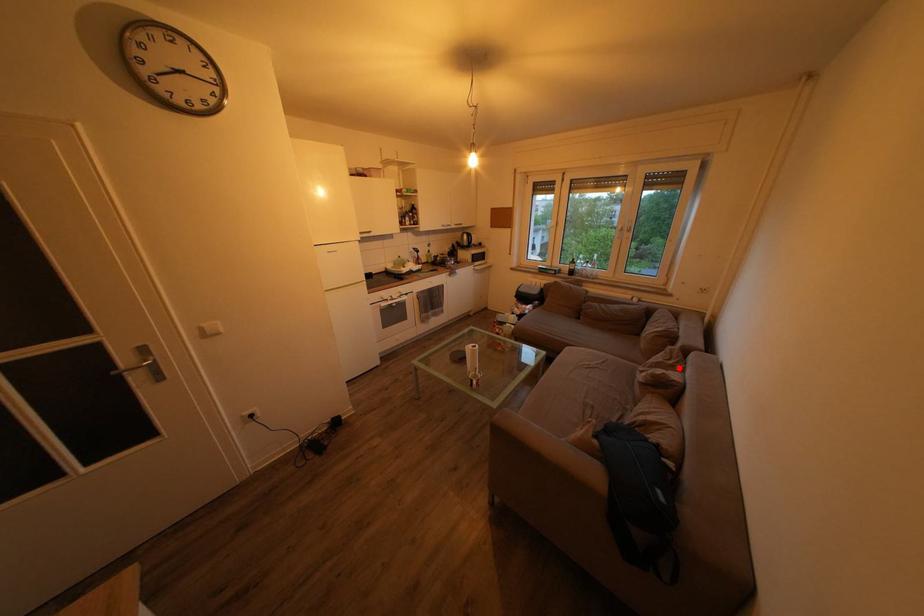
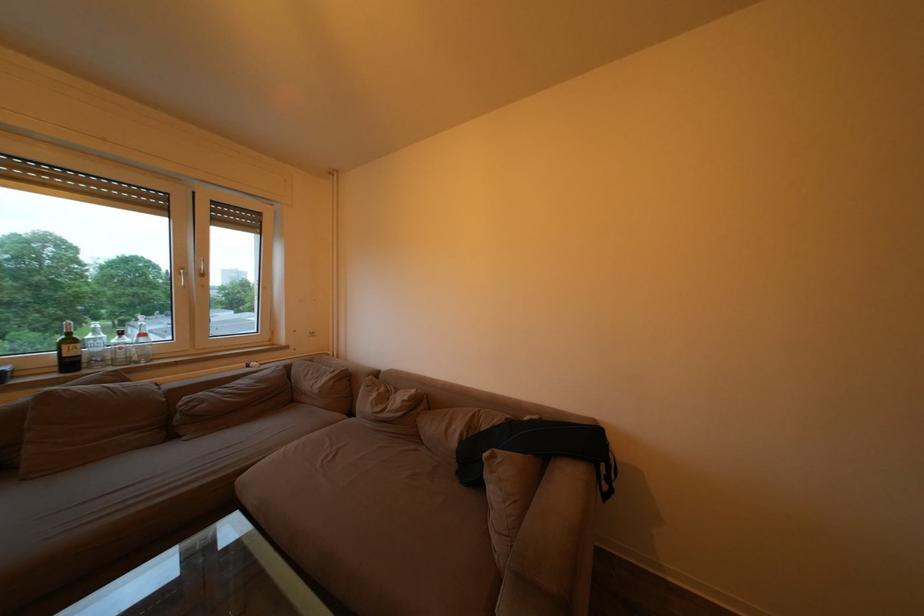
Find the pixel in the second image that matches the highlighted location in the first image.

(390, 395)